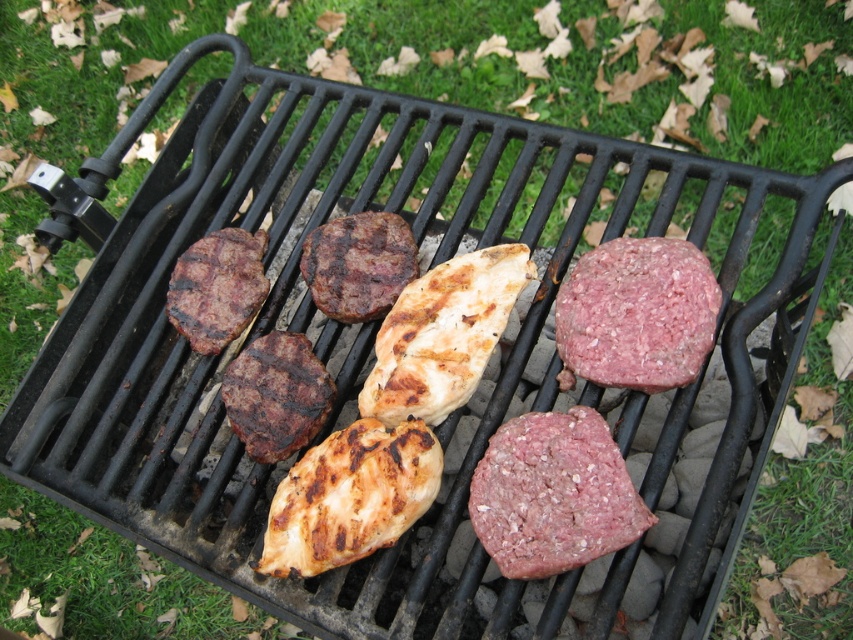
Question: Which point is farther to the camera?

Choices:
 (A) grilled brown steak at left
 (B) grilled brown beef patty at center
 (C) raw ground beef at bottom right

Answer: (A)

Question: Which object is the closest to the brown charred beef at center?

Choices:
 (A) grilled brown beef patty at center
 (B) raw pinkish-red meat at center-right
 (C) grilled brown steak at left

Answer: (A)

Question: Is raw pinkish-red meat at center-right positioned before grilled brown steak at left?

Choices:
 (A) yes
 (B) no

Answer: (A)

Question: Can you confirm if brown charred beef at center is smaller than grilled brown steak at left?

Choices:
 (A) no
 (B) yes

Answer: (B)

Question: Which point is farther to the camera?

Choices:
 (A) (633, 243)
 (B) (308, 410)
 (C) (233, 301)

Answer: (C)

Question: Can you confirm if raw pinkish-red meat at center-right is positioned above brown charred beef at center?

Choices:
 (A) yes
 (B) no

Answer: (A)